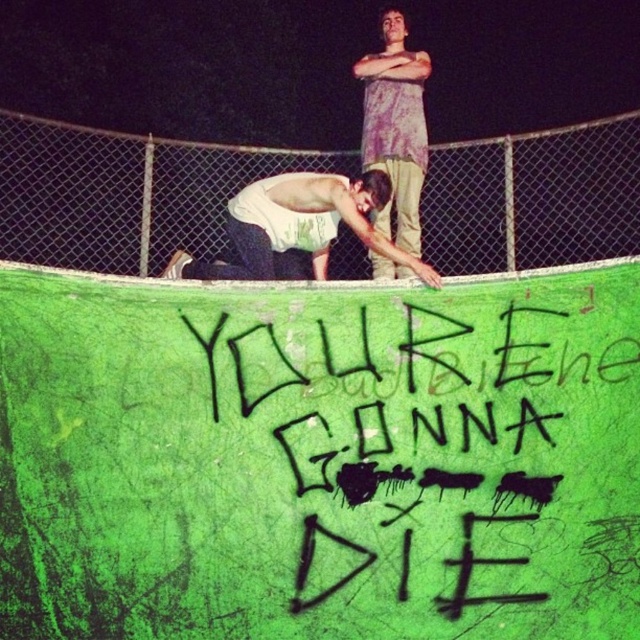
Question: Which point is farther from the camera taking this photo?

Choices:
 (A) (28, 212)
 (B) (396, 108)
 (C) (234, 221)
 (D) (268, 604)

Answer: (A)

Question: Considering the relative positions of black spray paint graffiti at center and distressed purple shirt at upper center in the image provided, where is black spray paint graffiti at center located with respect to distressed purple shirt at upper center?

Choices:
 (A) below
 (B) above

Answer: (A)

Question: Is white cotton shirt at center wider than distressed purple shirt at upper center?

Choices:
 (A) no
 (B) yes

Answer: (B)

Question: Which point appears closest to the camera in this image?

Choices:
 (A) (396, 161)
 (B) (308, 244)
 (C) (451, 157)
 (D) (582, 404)

Answer: (D)

Question: Which point is closer to the camera taking this photo?

Choices:
 (A) (579, 230)
 (B) (410, 252)

Answer: (B)

Question: Does green chain-link fence at upper center come in front of distressed purple shirt at upper center?

Choices:
 (A) no
 (B) yes

Answer: (A)